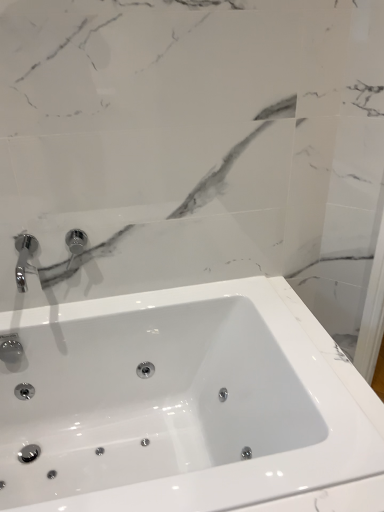
Question: Is chrome metallic faucet at upper left not inside white glossy sink at center?

Choices:
 (A) yes
 (B) no

Answer: (A)

Question: Does chrome metallic faucet at upper left lie in front of white glossy sink at center?

Choices:
 (A) yes
 (B) no

Answer: (B)

Question: Are chrome metallic faucet at upper left and white glossy sink at center making contact?

Choices:
 (A) no
 (B) yes

Answer: (A)

Question: Is white glossy sink at center completely or partially inside chrome metallic faucet at upper left?

Choices:
 (A) yes
 (B) no

Answer: (B)

Question: Is the depth of chrome metallic faucet at upper left greater than that of white glossy sink at center?

Choices:
 (A) yes
 (B) no

Answer: (A)

Question: Is chrome metallic faucet at upper left to the right of white glossy sink at center from the viewer's perspective?

Choices:
 (A) no
 (B) yes

Answer: (A)

Question: Can you confirm if white glossy sink at center is wider than chrome metallic faucet at upper left?

Choices:
 (A) no
 (B) yes

Answer: (B)

Question: Can you confirm if white glossy sink at center is positioned to the left of chrome metallic faucet at upper left?

Choices:
 (A) no
 (B) yes

Answer: (A)

Question: Is white glossy sink at center oriented away from chrome metallic faucet at upper left?

Choices:
 (A) yes
 (B) no

Answer: (B)

Question: Does white glossy sink at center have a lesser width compared to chrome metallic faucet at upper left?

Choices:
 (A) no
 (B) yes

Answer: (A)

Question: From the image's perspective, is white glossy sink at center on chrome metallic faucet at upper left?

Choices:
 (A) yes
 (B) no

Answer: (B)

Question: Are white glossy sink at center and chrome metallic faucet at upper left beside each other?

Choices:
 (A) no
 (B) yes

Answer: (A)

Question: From the image's perspective, is chrome metallic faucet at upper left above or below white glossy sink at center?

Choices:
 (A) above
 (B) below

Answer: (A)